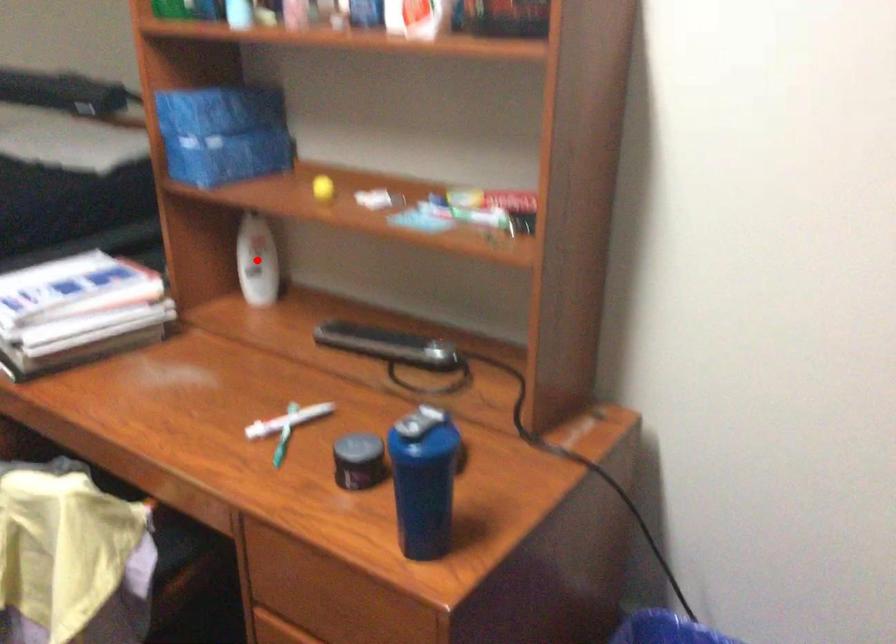
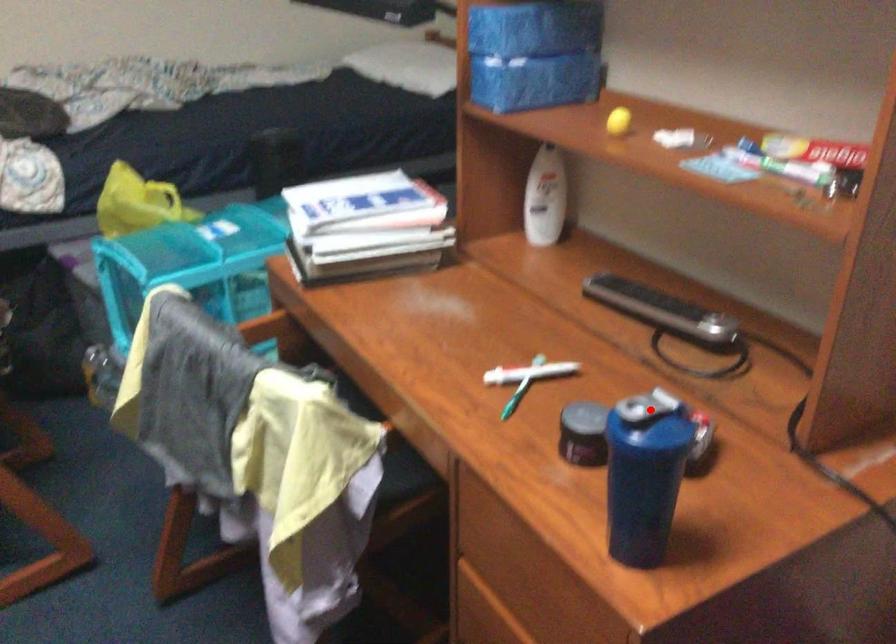
I am providing you with two images of the same scene from different viewpoints. A red point is marked on the first image and another point is marked on the second image. Is the marked point in image1 the same physical position as the marked point in image2?

No